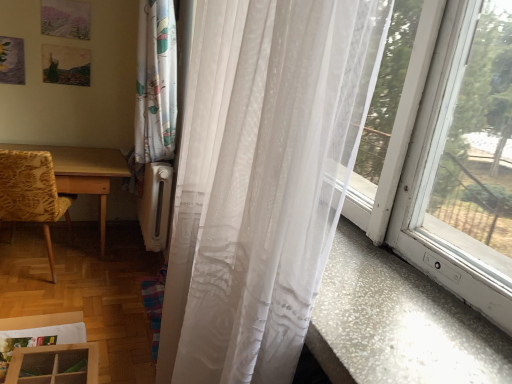
Question: Is yellow floral fabric chair at left positioned before wooden table at left?

Choices:
 (A) no
 (B) yes

Answer: (B)

Question: Is yellow floral fabric chair at left to the left of wooden table at left from the viewer's perspective?

Choices:
 (A) no
 (B) yes

Answer: (B)

Question: From a real-world perspective, is yellow floral fabric chair at left positioned over wooden table at left based on gravity?

Choices:
 (A) no
 (B) yes

Answer: (B)

Question: Considering the relative sizes of yellow floral fabric chair at left and wooden table at left in the image provided, is yellow floral fabric chair at left wider than wooden table at left?

Choices:
 (A) no
 (B) yes

Answer: (A)

Question: Is yellow floral fabric chair at left at the right side of wooden table at left?

Choices:
 (A) no
 (B) yes

Answer: (A)

Question: Considering the positions of yellow floral fabric chair at left and translucent white curtain at right in the image, is yellow floral fabric chair at left wider or thinner than translucent white curtain at right?

Choices:
 (A) thin
 (B) wide

Answer: (B)

Question: Does point (5, 192) appear closer or farther from the camera than point (266, 314)?

Choices:
 (A) farther
 (B) closer

Answer: (A)

Question: Considering the positions of yellow floral fabric chair at left and translucent white curtain at right in the image, is yellow floral fabric chair at left taller or shorter than translucent white curtain at right?

Choices:
 (A) tall
 (B) short

Answer: (B)

Question: In the image, is yellow floral fabric chair at left positioned in front of or behind translucent white curtain at right?

Choices:
 (A) behind
 (B) front

Answer: (A)

Question: Is translucent white curtain at right taller or shorter than wooden table at left?

Choices:
 (A) short
 (B) tall

Answer: (B)

Question: From a real-world perspective, relative to wooden table at left, is translucent white curtain at right vertically above or below?

Choices:
 (A) above
 (B) below

Answer: (A)

Question: Looking at the image, does translucent white curtain at right seem bigger or smaller compared to wooden table at left?

Choices:
 (A) big
 (B) small

Answer: (B)

Question: In the image, is translucent white curtain at right on the left side or the right side of wooden table at left?

Choices:
 (A) left
 (B) right

Answer: (B)

Question: Considering the positions of yellow floral fabric chair at left and wooden table at left in the image, is yellow floral fabric chair at left taller or shorter than wooden table at left?

Choices:
 (A) short
 (B) tall

Answer: (B)

Question: Would you say yellow floral fabric chair at left is to the left or to the right of wooden table at left in the picture?

Choices:
 (A) right
 (B) left

Answer: (B)